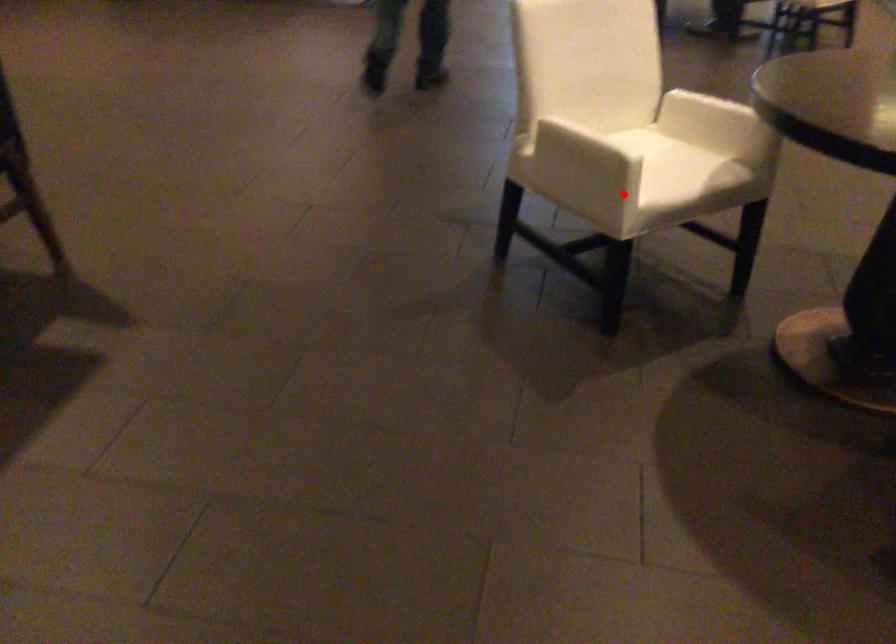
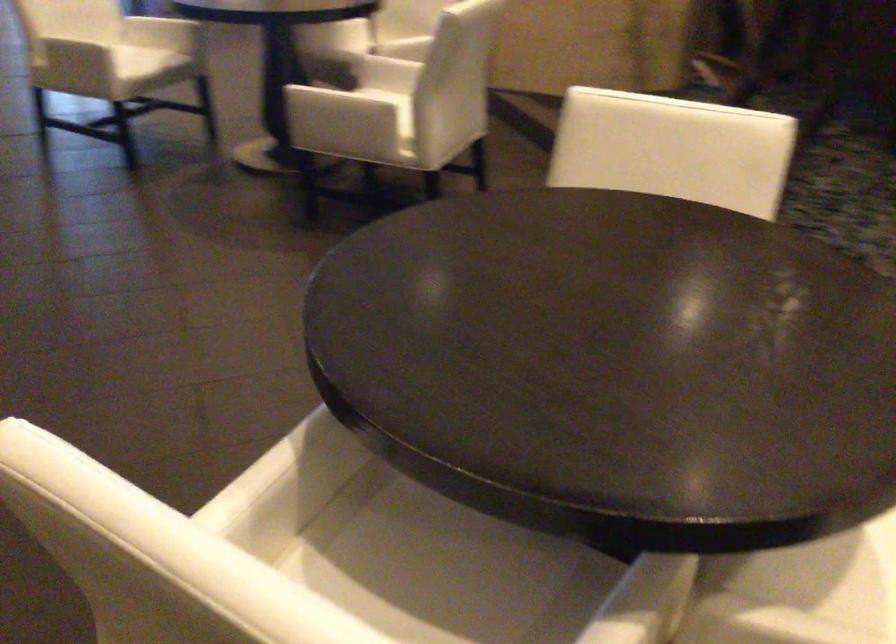
In the second image, find the point that corresponds to the highlighted location in the first image.

(71, 39)